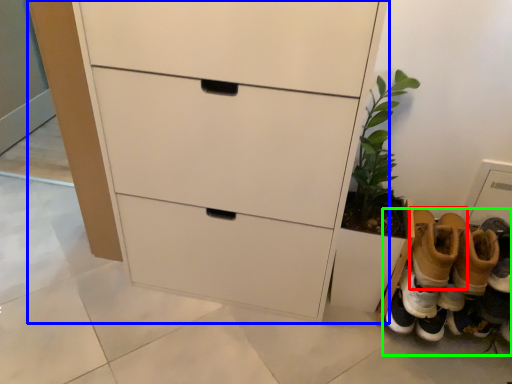
Question: Based on their relative distances, which object is farther from footwear (highlighted by a red box)? Choose from chest of drawers (highlighted by a blue box) and footwear (highlighted by a green box).

Choices:
 (A) chest of drawers
 (B) footwear

Answer: (A)